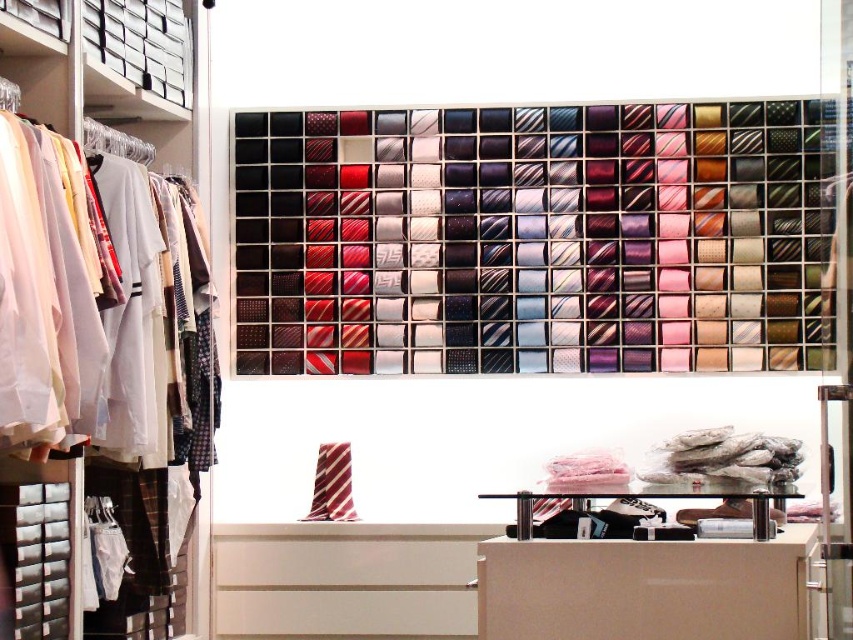
Question: Can you confirm if silky woven ties at upper center is wider than striped fabric tie at center?

Choices:
 (A) no
 (B) yes

Answer: (B)

Question: Is silky woven ties at upper center above matte white shirts at left?

Choices:
 (A) yes
 (B) no

Answer: (B)

Question: Which of these objects is positioned farthest from the matte white shirts at left?

Choices:
 (A) silky woven ties at upper center
 (B) striped fabric tie at center

Answer: (B)

Question: Does matte white shirts at left appear on the right side of striped fabric tie at center?

Choices:
 (A) yes
 (B) no

Answer: (B)

Question: Among these points, which one is nearest to the camera?

Choices:
 (A) (467, 280)
 (B) (328, 500)

Answer: (B)

Question: Among these points, which one is farthest from the camera?

Choices:
 (A) (424, 150)
 (B) (312, 492)
 (C) (204, 192)

Answer: (A)